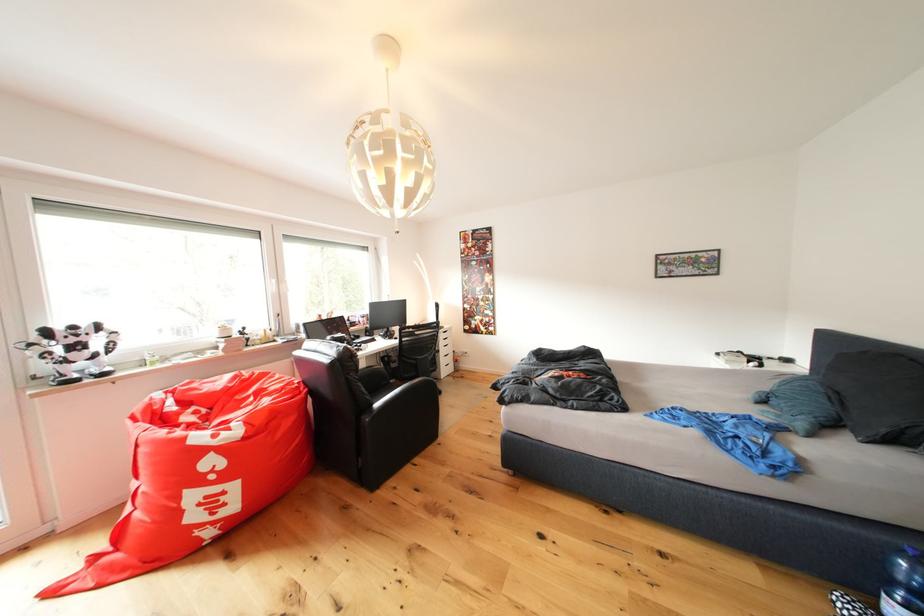
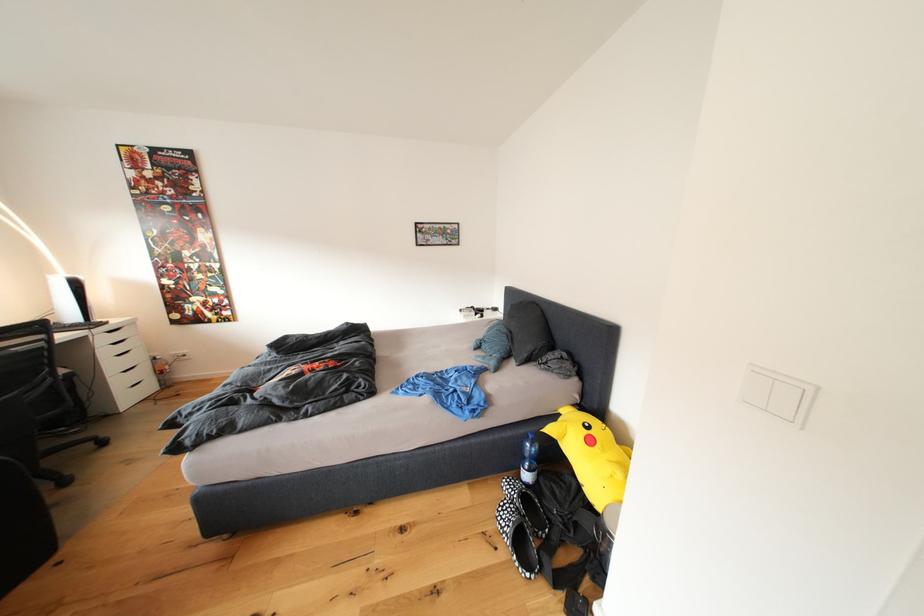
Where in the second image is the point corresponding to point (726, 359) from the first image?

(469, 315)